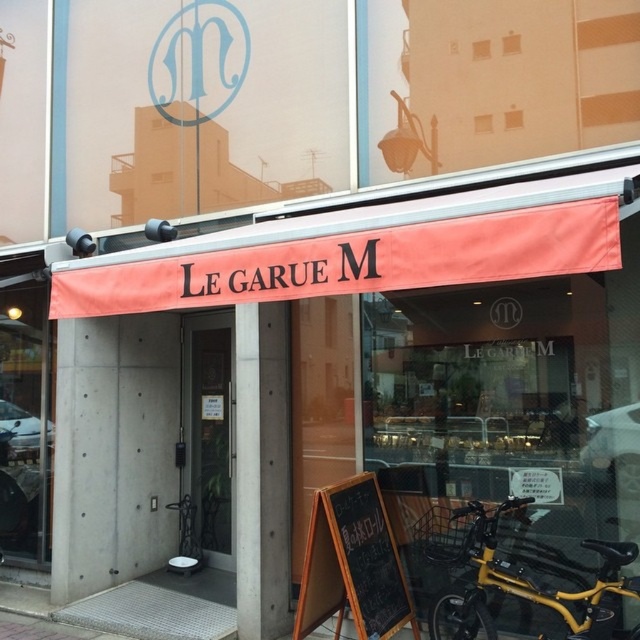
Question: Does orange fabric awning at center appear on the right side of yellow metallic bicycle at lower right?

Choices:
 (A) yes
 (B) no

Answer: (B)

Question: Is orange fabric awning at center above black chalkboard at center?

Choices:
 (A) yes
 (B) no

Answer: (A)

Question: Which object is the closest to the black chalkboard at center?

Choices:
 (A) orange fabric awning at center
 (B) yellow metallic bicycle at lower right

Answer: (B)

Question: Can you confirm if yellow metallic bicycle at lower right is thinner than black chalkboard at center?

Choices:
 (A) no
 (B) yes

Answer: (A)

Question: Which of the following is the farthest from the observer?

Choices:
 (A) (269, 605)
 (B) (408, 621)

Answer: (A)

Question: Which point appears farthest from the camera in this image?

Choices:
 (A) (323, 410)
 (B) (502, 504)

Answer: (A)